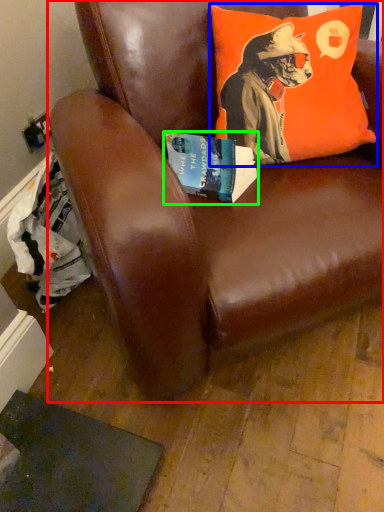
Question: Which object is the closest to the chair (highlighted by a red box)? Choose among these: pillow (highlighted by a blue box) or book (highlighted by a green box).

Choices:
 (A) pillow
 (B) book

Answer: (A)